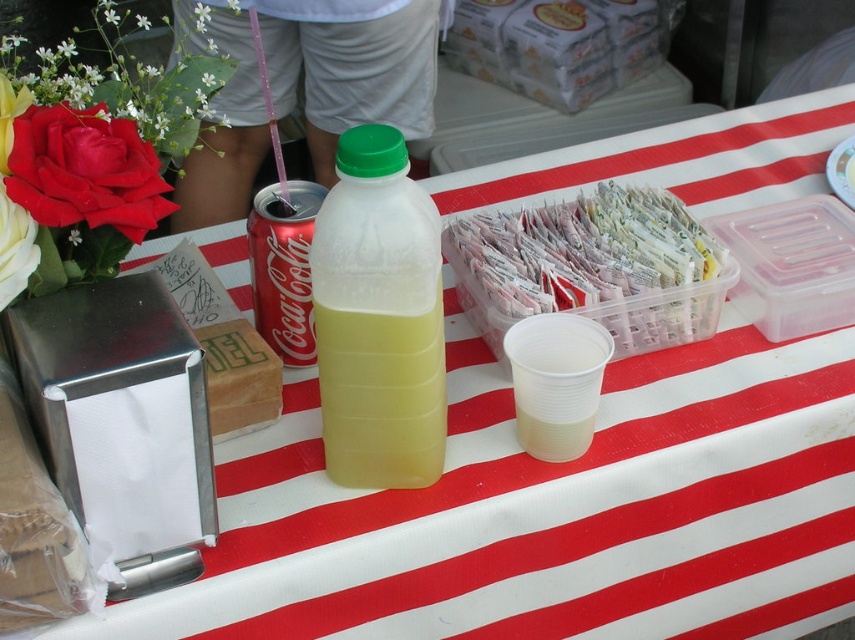
Between matte aluminum can at left and white matte rose at left, which one appears on the left side from the viewer's perspective?

From the viewer's perspective, white matte rose at left appears more on the left side.

Does matte aluminum can at left appear on the right side of white matte rose at left?

Indeed, matte aluminum can at left is positioned on the right side of white matte rose at left.

Is point (252, 216) closer to camera compared to point (9, 209)?

No, (252, 216) is further to viewer.

This screenshot has width=855, height=640. In order to click on matte aluminum can at left in this screenshot , I will do `click(282, 266)`.

Which is behind, point (593, 218) or point (15, 272)?

The point (593, 218) is behind.

Can you confirm if clear plastic container at center is positioned above white matte rose at left?

Correct, clear plastic container at center is located above white matte rose at left.

Is point (579, 300) positioned in front of point (7, 218)?

No, (579, 300) is further to viewer.

You are a GUI agent. You are given a task and a screenshot of the screen. Output one action in this format:
    pyautogui.click(x=<x>, y=<y>)
    Task: Click on the clear plastic container at center
    Image resolution: width=855 pixels, height=640 pixels.
    Given the screenshot: What is the action you would take?
    pyautogui.click(x=593, y=268)

Is silky red rose at upper left bigger than white matte flower at upper left?

No, silky red rose at upper left is not bigger than white matte flower at upper left.

Does point (110, 202) lie in front of point (103, 17)?

That is True.

Who is more forward, (57,180) or (111,4)?

Positioned in front is point (57,180).

Locate an element on the screen. This screenshot has height=640, width=855. silky red rose at upper left is located at coordinates (86, 172).